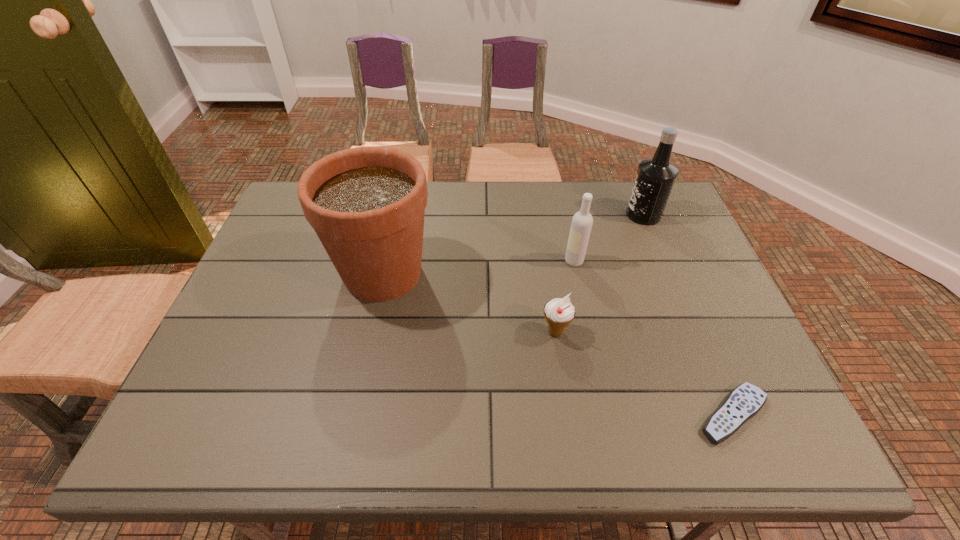
What are the coordinates of `object that is positioned at the near right corner` in the screenshot? It's located at (745, 401).

Image resolution: width=960 pixels, height=540 pixels. In order to click on free space at the far edge of the desktop in this screenshot , I will do `click(490, 218)`.

In order to click on blank space at the near edge of the desktop in this screenshot , I will do `click(696, 414)`.

In the image, there is a desktop. At what (x,y) coordinates should I click in order to perform the action: click on vacant space at the left edge. Please return your answer as a coordinate pair (x, y). The width and height of the screenshot is (960, 540). Looking at the image, I should click on (293, 287).

This screenshot has height=540, width=960. Identify the location of vacant space at the right edge. (707, 345).

At what (x,y) coordinates should I click in order to perform the action: click on free space at the far left corner. Please return your answer as a coordinate pair (x, y). Looking at the image, I should click on (283, 208).

Find the location of a particular element. free region at the far right corner of the desktop is located at coordinates (671, 199).

Identify the location of free area in between the liquor and the remote control. The width and height of the screenshot is (960, 540). (688, 315).

The height and width of the screenshot is (540, 960). Identify the location of free spot between the liquor and the second object from left to right. (599, 273).

What are the coordinates of `free space between the flowerpot and the third object from left to right` in the screenshot? It's located at (478, 267).